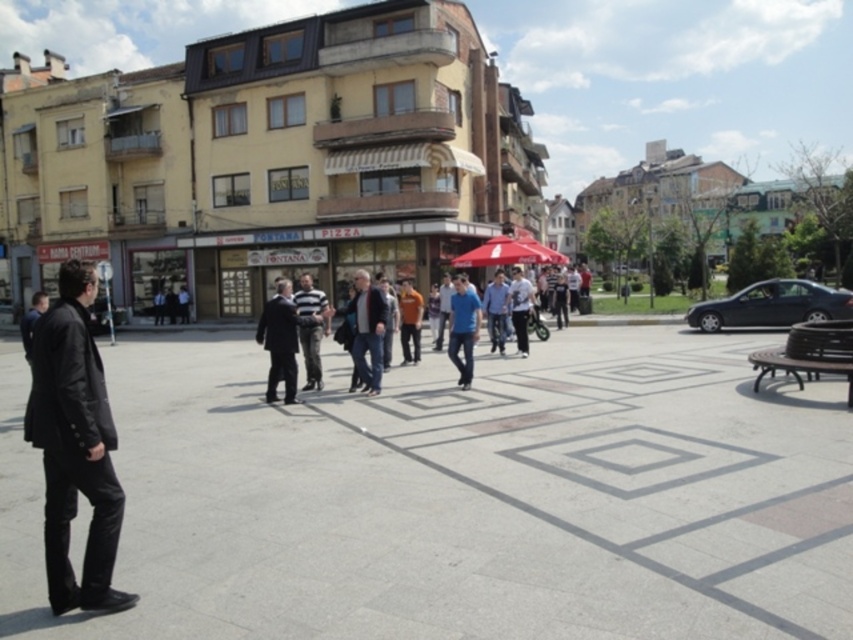
What are the coordinates of the dark gray suit at center?

The coordinates of the dark gray suit at center are at point (283, 339).

You are standing at the corner of the light yellow building in the middle ground. You see two points marked in the scene. Which point is closer to you, point (294, 380) or point (329, 307)?

Point (294, 380) is in front of point (329, 307), so it is closer to you.